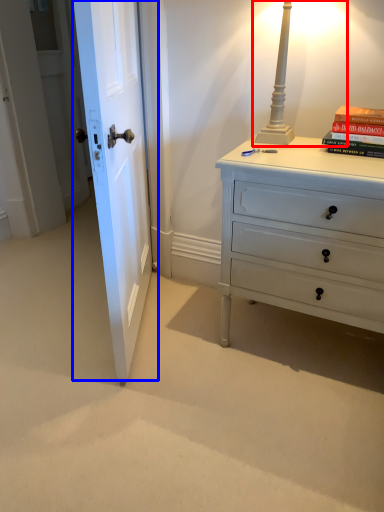
Question: Which object is closer to the camera taking this photo, table lamp (highlighted by a red box) or door (highlighted by a blue box)?

Choices:
 (A) table lamp
 (B) door

Answer: (B)